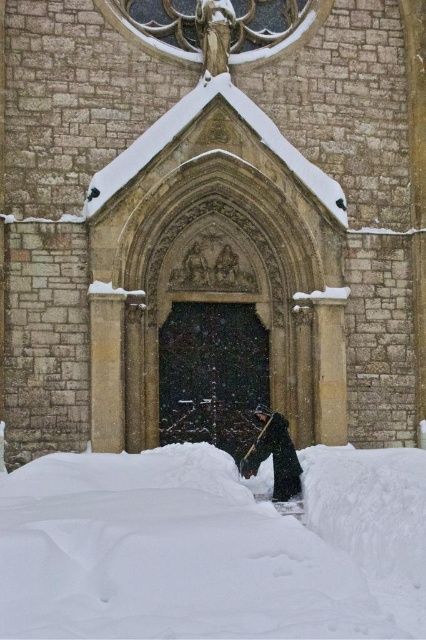
Which of these two, stone church at center or white fluffy snow at lower center, stands shorter?

white fluffy snow at lower center is shorter.

Who is higher up, stone church at center or white fluffy snow at lower center?

stone church at center is above.

Identify the location of stone church at center. This screenshot has height=640, width=426. (210, 216).

Which is more to the right, stone church at center or dark woolen coat at center?

Positioned to the right is dark woolen coat at center.

Does point (207, 221) come closer to viewer compared to point (298, 490)?

No, (207, 221) is further to viewer.

Is point (239, 70) positioned after point (241, 460)?

That is True.

This screenshot has width=426, height=640. I want to click on stone church at center, so click(x=210, y=216).

Is point (166, 634) positioned behind point (250, 468)?

No, (166, 634) is in front of (250, 468).

Who is more distant from viewer, (x=331, y=600) or (x=281, y=451)?

Point (x=281, y=451)

Who is more forward, [118,618] or [241,468]?

Point [118,618] is more forward.

Where is `white fluffy snow at lower center`? white fluffy snow at lower center is located at coordinates (212, 547).